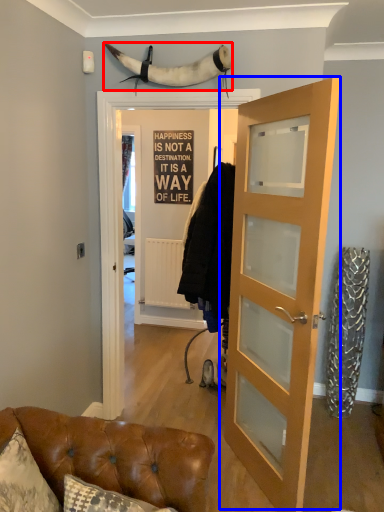
Question: Which object appears closest to the camera in this image, animal (highlighted by a red box) or door (highlighted by a blue box)?

Choices:
 (A) animal
 (B) door

Answer: (B)